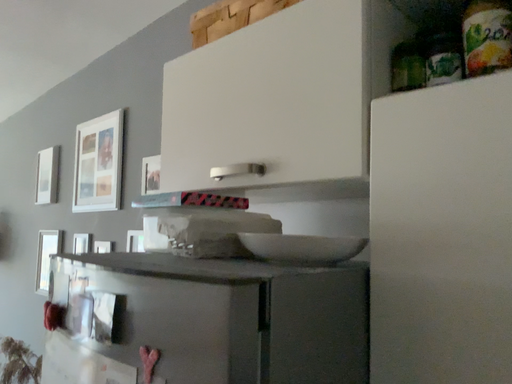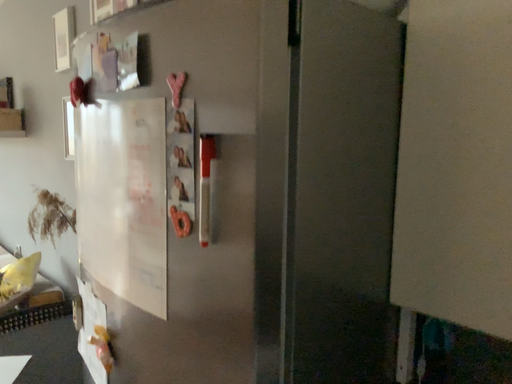
Question: How did the camera likely rotate when shooting the video?

Choices:
 (A) rotated downward
 (B) rotated upward

Answer: (A)